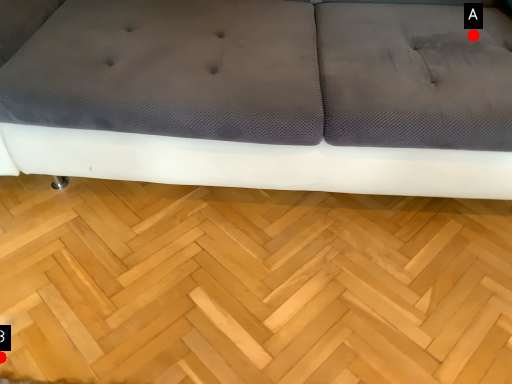
Question: Two points are circled on the image, labeled by A and B beside each circle. Which point is closer to the camera taking this photo?

Choices:
 (A) A is closer
 (B) B is closer

Answer: (B)